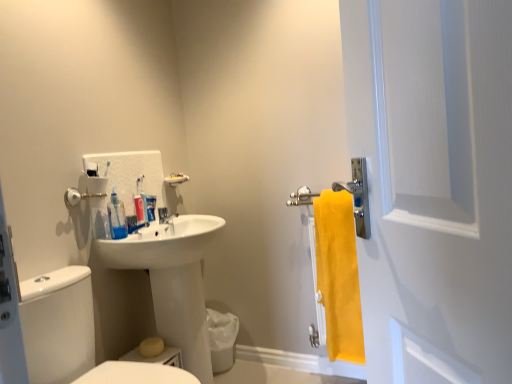
Question: Which direction should I rotate to look at translucent plastic toothpaste tube at upper center?

Choices:
 (A) right
 (B) left

Answer: (B)

Question: Can you confirm if white matte toothpaste at center is thinner than translucent plastic toothpaste tube at upper center?

Choices:
 (A) no
 (B) yes

Answer: (B)

Question: Is white matte toothpaste at center smaller than translucent plastic toothpaste tube at upper center?

Choices:
 (A) yes
 (B) no

Answer: (B)

Question: Is white matte toothpaste at center with translucent plastic toothpaste tube at upper center?

Choices:
 (A) yes
 (B) no

Answer: (A)

Question: From a real-world perspective, is white matte toothpaste at center physically above translucent plastic toothpaste tube at upper center?

Choices:
 (A) no
 (B) yes

Answer: (A)

Question: Would you say white matte toothpaste at center contains translucent plastic toothpaste tube at upper center?

Choices:
 (A) no
 (B) yes

Answer: (A)

Question: Considering the relative positions of white matte toothpaste at center and translucent plastic toothpaste tube at upper center in the image provided, is white matte toothpaste at center in front of translucent plastic toothpaste tube at upper center?

Choices:
 (A) yes
 (B) no

Answer: (B)

Question: From the image's perspective, would you say yellow fabric towel at right is positioned over white glossy sink at center?

Choices:
 (A) yes
 (B) no

Answer: (A)

Question: Is yellow fabric towel at right not close to white glossy sink at center?

Choices:
 (A) no
 (B) yes

Answer: (A)

Question: Is yellow fabric towel at right in front of white glossy sink at center?

Choices:
 (A) yes
 (B) no

Answer: (B)

Question: Is yellow fabric towel at right next to white glossy sink at center?

Choices:
 (A) yes
 (B) no

Answer: (B)

Question: From a real-world perspective, is yellow fabric towel at right located higher than white glossy sink at center?

Choices:
 (A) no
 (B) yes

Answer: (B)

Question: From the image's perspective, would you say yellow fabric towel at right is shown under white glossy sink at center?

Choices:
 (A) yes
 (B) no

Answer: (B)

Question: Is white glossy sink at center taller than white matte screen door at right?

Choices:
 (A) no
 (B) yes

Answer: (B)